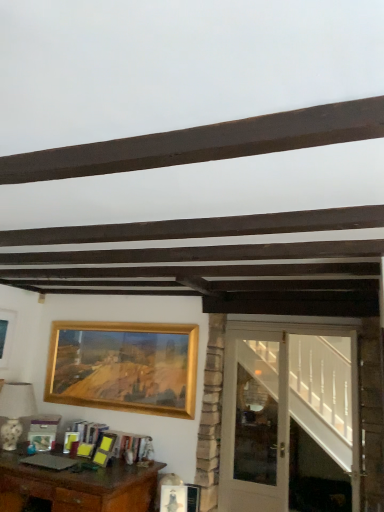
What do you see at coordinates (78, 486) in the screenshot? I see `brown wooden desk at lower left` at bounding box center [78, 486].

At what (x,y) coordinates should I click in order to perform the action: click on white glass door at right. Please return your answer as a coordinate pair (x, y). Looking at the image, I should click on (254, 423).

The height and width of the screenshot is (512, 384). What do you see at coordinates (289, 419) in the screenshot?
I see `white glossy door at right` at bounding box center [289, 419].

This screenshot has height=512, width=384. What do you see at coordinates (124, 366) in the screenshot? I see `gold metallic picture frame at upper center, arranged as the 2th picture frame when viewed from the left` at bounding box center [124, 366].

I want to click on brown wooden desk at lower left, so click(78, 486).

Is gold metallic picture frame at upper left, which ranks as the first picture frame in left-to-right order, surrounding white glass door at right?

Definitely not — white glass door at right is not inside gold metallic picture frame at upper left, which ranks as the first picture frame in left-to-right order.

Which object is thinner, gold metallic picture frame at upper left, which ranks as the first picture frame in left-to-right order, or white glass door at right?

Thinner between the two is gold metallic picture frame at upper left, which ranks as the first picture frame in left-to-right order.

Identify the location of the 2nd picture frame behind the white glass door at right, starting your count from the anchor. Image resolution: width=384 pixels, height=512 pixels. (6, 335).

Between point (13, 327) and point (19, 413), which one is positioned in front?

Positioned in front is point (19, 413).

Could you tell me if gold metallic picture frame at upper left, the second picture frame in the right-to-left sequence, is turned towards white glossy lampshade at left?

No, gold metallic picture frame at upper left, the second picture frame in the right-to-left sequence, is not facing towards white glossy lampshade at left.

From a real-world perspective, is gold metallic picture frame at upper left, the second picture frame in the right-to-left sequence, positioned above or below white glossy lampshade at left?

gold metallic picture frame at upper left, the second picture frame in the right-to-left sequence, is situated higher than white glossy lampshade at left in the real world.

Could you tell me if white glossy lampshade at left is turned towards white glossy door at right?

No.

Is white glossy lampshade at left taller than white glossy door at right?

Incorrect, the height of white glossy lampshade at left is not larger of that of white glossy door at right.

From the image's perspective, is white glossy lampshade at left above white glossy door at right?

No, from the image's perspective, white glossy lampshade at left is not above white glossy door at right.

Is white glossy lampshade at left to the left of white glossy door at right from the viewer's perspective?

Yes, white glossy lampshade at left is to the left of white glossy door at right.

Is brown wooden desk at lower left positioned beyond the bounds of gold metallic picture frame at upper left, which ranks as the first picture frame in left-to-right order?

That's correct, brown wooden desk at lower left is outside of gold metallic picture frame at upper left, which ranks as the first picture frame in left-to-right order.

From a real-world perspective, is brown wooden desk at lower left above or below gold metallic picture frame at upper left, the second picture frame in the right-to-left sequence?

brown wooden desk at lower left is situated lower than gold metallic picture frame at upper left, the second picture frame in the right-to-left sequence, in the real world.

Can you confirm if brown wooden desk at lower left is smaller than gold metallic picture frame at upper left, which ranks as the first picture frame in left-to-right order?

No.

Is brown wooden desk at lower left next to gold metallic picture frame at upper left, the second picture frame in the right-to-left sequence?

No, brown wooden desk at lower left is not beside gold metallic picture frame at upper left, the second picture frame in the right-to-left sequence.

Is white glossy door at right located outside white glossy lampshade at left?

That's correct, white glossy door at right is outside of white glossy lampshade at left.

From a real-world perspective, who is located lower, white glossy door at right or white glossy lampshade at left?

white glossy lampshade at left is physically lower.

Between white glossy door at right and white glossy lampshade at left, which one has smaller size?

white glossy lampshade at left is smaller.

Can you tell me how much white glossy door at right and white glossy lampshade at left differ in facing direction?

white glossy door at right and white glossy lampshade at left are facing 3.86 degrees away from each other.

Could you tell me if white glass door at right is facing brown wooden desk at lower left?

No, white glass door at right is not facing towards brown wooden desk at lower left.

Is point (252, 356) less distant than point (146, 493)?

No, (252, 356) is behind (146, 493).

In the image, is white glass door at right on the left side or the right side of brown wooden desk at lower left?

From the image, it's evident that white glass door at right is to the right of brown wooden desk at lower left.

Between white glass door at right and brown wooden desk at lower left, which one has more height?

With more height is white glass door at right.

Which is less distant, (102, 376) or (1, 367)?

Clearly, point (102, 376) is closer to the camera than point (1, 367).

Is gold metallic picture frame at upper center, which is the 1th picture frame in right-to-left order, inside or outside of gold metallic picture frame at upper left, which ranks as the first picture frame in left-to-right order?

gold metallic picture frame at upper center, which is the 1th picture frame in right-to-left order, is outside gold metallic picture frame at upper left, which ranks as the first picture frame in left-to-right order.

From the image's perspective, is gold metallic picture frame at upper center, arranged as the 2th picture frame when viewed from the left, under gold metallic picture frame at upper left, which ranks as the first picture frame in left-to-right order?

Yes.

Which object is positioned more to the left, gold metallic picture frame at upper center, which is the 1th picture frame in right-to-left order, or gold metallic picture frame at upper left, the second picture frame in the right-to-left sequence?

gold metallic picture frame at upper left, the second picture frame in the right-to-left sequence.

I want to click on the 2nd picture frame directly above the white glass door at right (from a real-world perspective), so click(6, 335).

I want to click on lamp lying in front of the gold metallic picture frame at upper left, the second picture frame in the right-to-left sequence, so click(x=15, y=411).

Estimate the real-world distances between objects in this image. Which object is further from gold metallic picture frame at upper left, which ranks as the first picture frame in left-to-right order, white glass door at right or brown wooden desk at lower left?

Based on the image, white glass door at right appears to be further to gold metallic picture frame at upper left, which ranks as the first picture frame in left-to-right order.

From the image, which object appears to be nearer to white glossy lampshade at left, gold metallic picture frame at upper left, which ranks as the first picture frame in left-to-right order, or white glossy door at right?

gold metallic picture frame at upper left, which ranks as the first picture frame in left-to-right order, lies closer to white glossy lampshade at left than the other object.

Looking at the image, which one is located further to white glossy lampshade at left, white glossy door at right or brown wooden desk at lower left?

Among the two, white glossy door at right is located further to white glossy lampshade at left.

Looking at the image, which one is located closer to white glossy lampshade at left, brown wooden desk at lower left or gold metallic picture frame at upper left, which ranks as the first picture frame in left-to-right order?

gold metallic picture frame at upper left, which ranks as the first picture frame in left-to-right order, lies closer to white glossy lampshade at left than the other object.

Which object lies further to the anchor point white glossy door at right, brown wooden desk at lower left or white glossy lampshade at left?

white glossy lampshade at left lies further to white glossy door at right than the other object.

Considering their positions, is white glossy door at right positioned further to white glass door at right than white glossy lampshade at left?

white glossy lampshade at left is positioned further to the anchor white glass door at right.

Based on the photo, estimate the real-world distances between objects in this image. Which object is closer to white glossy lampshade at left, white glossy door at right or white glass door at right?

Among the two, white glass door at right is located nearer to white glossy lampshade at left.

Estimate the real-world distances between objects in this image. Which object is further from white glossy lampshade at left, brown wooden desk at lower left or gold metallic picture frame at upper center, which is the 1th picture frame in right-to-left order?

Based on the image, gold metallic picture frame at upper center, which is the 1th picture frame in right-to-left order, appears to be further to white glossy lampshade at left.

Find the location of a particular element. picture frame between white glossy lampshade at left and white glossy door at right from left to right is located at coordinates (124, 366).

Locate an element on the screen. The image size is (384, 512). picture frame between gold metallic picture frame at upper left, the second picture frame in the right-to-left sequence, and white glass door at right from left to right is located at coordinates (124, 366).

Locate an element on the screen. picture frame between white glossy lampshade at left and white glass door at right is located at coordinates (124, 366).

Image resolution: width=384 pixels, height=512 pixels. I want to click on glass door situated between gold metallic picture frame at upper left, which ranks as the first picture frame in left-to-right order, and white glossy door at right from left to right, so click(x=254, y=423).